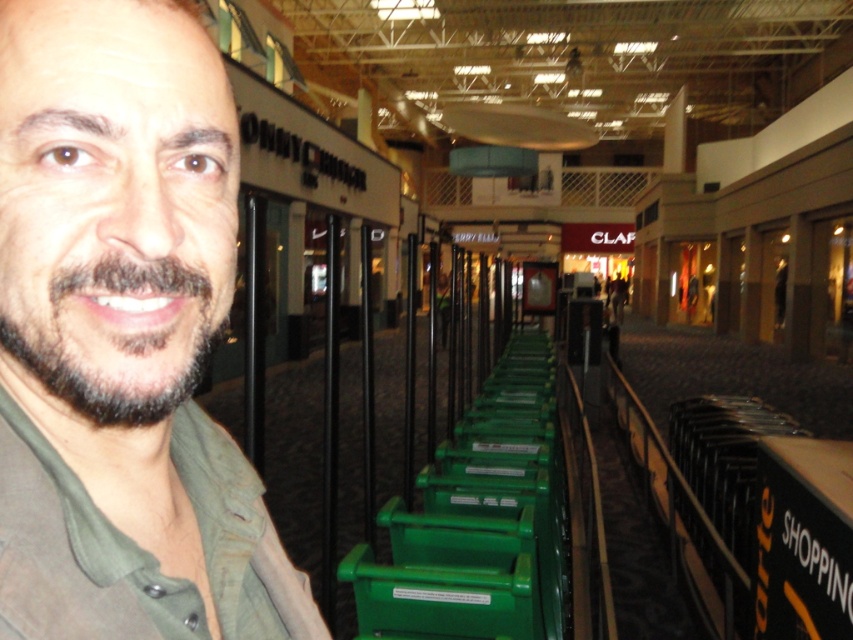
Between matte green shirt at center and dark brown fuzzy beard at left, which one has more height?

matte green shirt at center

Is the position of matte green shirt at center less distant than that of dark brown fuzzy beard at left?

Yes.

Is point (181, 541) farther from viewer compared to point (111, 333)?

Yes, it is.

The height and width of the screenshot is (640, 853). In order to click on matte green shirt at center in this screenshot , I will do `click(122, 337)`.